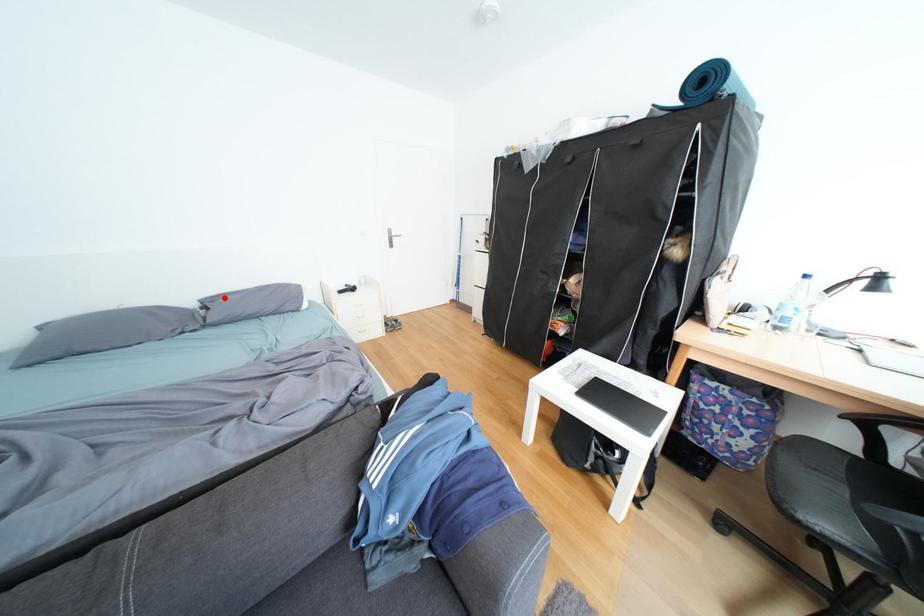
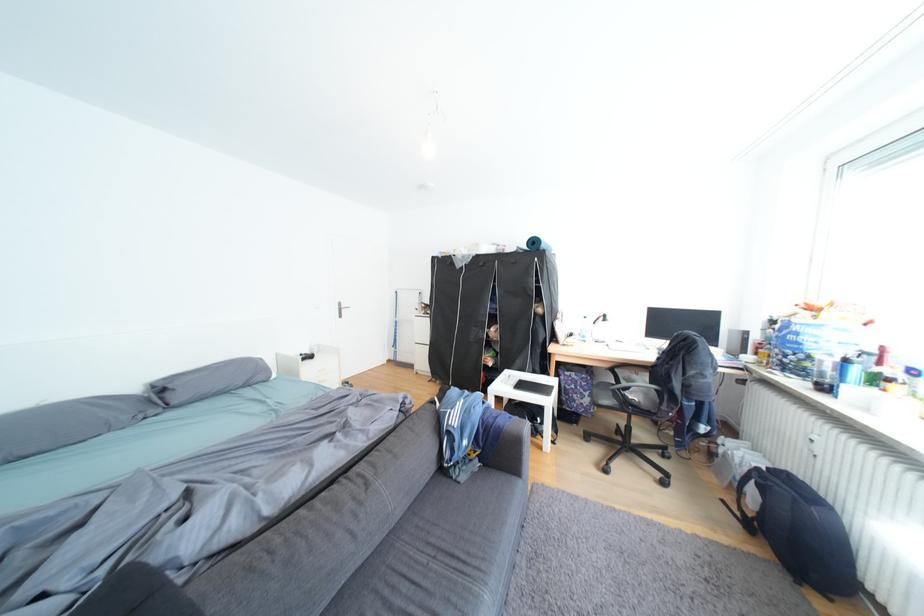
Question: I am providing you with two images of the same scene from different viewpoints. A red point is shown in image1. For the corresponding object point in image2, is it positioned nearer or farther from the camera?

Choices:
 (A) Nearer
 (B) Farther

Answer: (B)